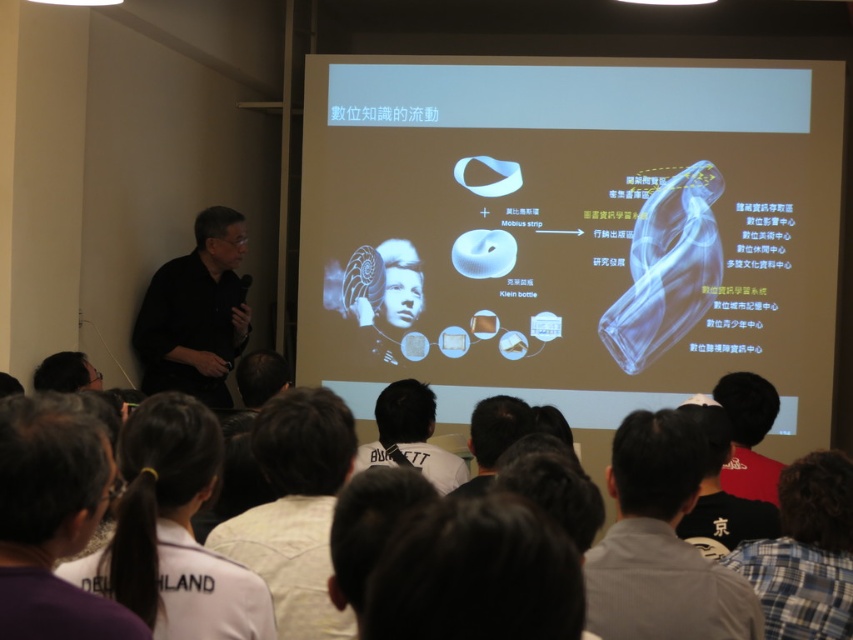
You are organizing a clothing donation drive and need to determine which shirt takes up more space when folded. Based on the image, which shirt between the plaid shirt at lower right and the red cotton shirt at lower right would require more space due to its width?

The plaid shirt at lower right might be wider than red cotton shirt at lower right, so it would require more space when folded.

You are attending a presentation and notice two shirts in the scene. The black matte shirt at left and the white cotton shirt at lower center. Which shirt is covering part of the other?

The black matte shirt at left is positioned over white cotton shirt at lower center, so it is covering part of the white cotton shirt at lower center.